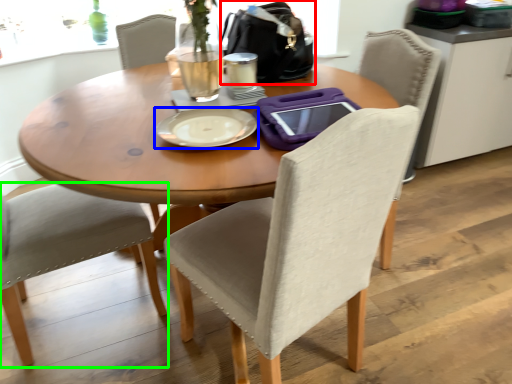
Question: Based on their relative distances, which object is farther from handbag (highlighted by a red box)? Choose from plate (highlighted by a blue box) and chair (highlighted by a green box).

Choices:
 (A) plate
 (B) chair

Answer: (B)